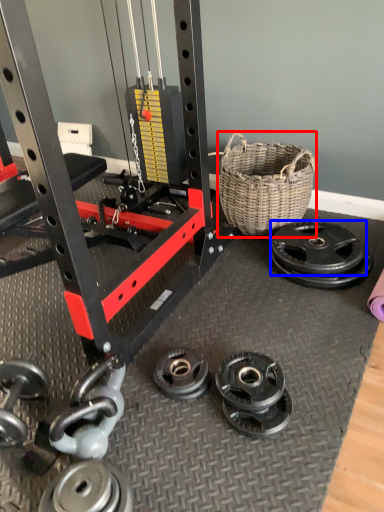
Question: Which object is further to the camera taking this photo, picnic basket (highlighted by a red box) or wheel (highlighted by a blue box)?

Choices:
 (A) picnic basket
 (B) wheel

Answer: (A)